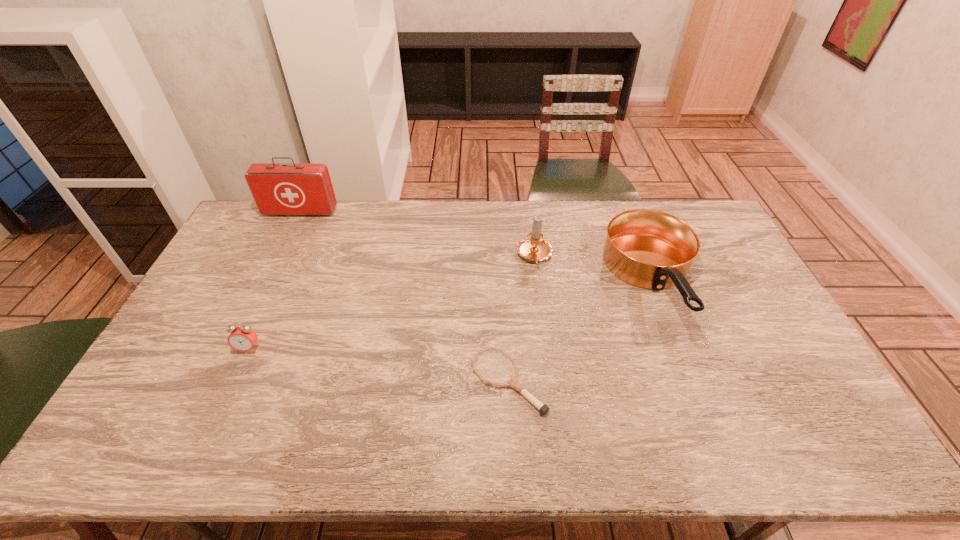
The image size is (960, 540). In order to click on the farthest object in this screenshot , I will do `click(293, 188)`.

Where is `the first-aid kit`? This screenshot has width=960, height=540. the first-aid kit is located at coordinates (293, 188).

The width and height of the screenshot is (960, 540). I want to click on frying pan, so click(x=650, y=249).

This screenshot has width=960, height=540. Identify the location of candle. (534, 247).

This screenshot has height=540, width=960. Find the location of `the fourth tallest object`. the fourth tallest object is located at coordinates (242, 338).

You are a GUI agent. You are given a task and a screenshot of the screen. Output one action in this format:
    pyautogui.click(x=<x>, y=<y>)
    Task: Click on the tennis racket
    Image resolution: width=960 pixels, height=540 pixels.
    Given the screenshot: What is the action you would take?
    pyautogui.click(x=513, y=382)

The image size is (960, 540). Find the location of `blank space located on the side of the first-aid kit with the first aid cross symbol`. blank space located on the side of the first-aid kit with the first aid cross symbol is located at coordinates (289, 236).

Find the location of a particular element. vacant area situated 0.300m on the handle side of the rightmost object is located at coordinates (719, 454).

Where is `free region located on the left of the candle`? The image size is (960, 540). free region located on the left of the candle is located at coordinates [x=433, y=256].

I want to click on vacant region located on the front-facing side of the second shortest object, so click(x=226, y=400).